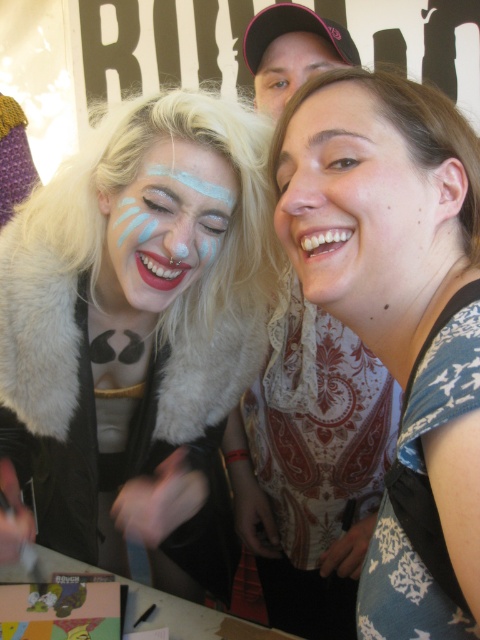
Question: Estimate the real-world distances between objects in this image. Which object is farther from the matte white face paint at center?

Choices:
 (A) fur coat at center
 (B) matte black cap at upper center
 (C) smooth skin face at center

Answer: (B)

Question: Can you confirm if fur coat at center is thinner than matte black cap at upper center?

Choices:
 (A) no
 (B) yes

Answer: (A)

Question: Estimate the real-world distances between objects in this image. Which object is farther from the matte black cap at upper center?

Choices:
 (A) smooth skin face at center
 (B) fur coat at center
 (C) white lace dress at center

Answer: (C)

Question: Which of the following is the closest to the observer?

Choices:
 (A) white lace dress at center
 (B) fur coat at center
 (C) matte white face paint at center

Answer: (A)

Question: Can you confirm if white lace dress at center is bigger than smooth skin face at center?

Choices:
 (A) yes
 (B) no

Answer: (A)

Question: From the image, what is the correct spatial relationship of smooth skin face at center in relation to matte black cap at upper center?

Choices:
 (A) left
 (B) right

Answer: (B)